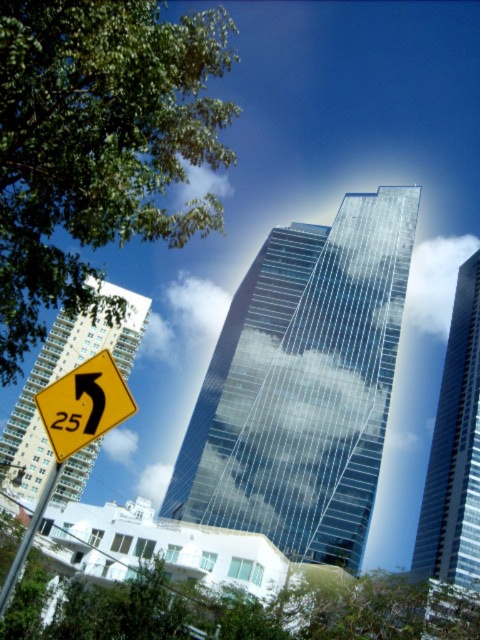
Question: Does green leafy tree at upper left appear over metallic pole at lower left?

Choices:
 (A) no
 (B) yes

Answer: (B)

Question: Does green leafy tree at upper left have a larger size compared to yellow plastic sign at lower left?

Choices:
 (A) yes
 (B) no

Answer: (A)

Question: Which of the following is the closest to the observer?

Choices:
 (A) yellow plastic sign at lower left
 (B) green leafy tree at upper left
 (C) metallic pole at lower left

Answer: (A)

Question: Does green leafy tree at upper left have a smaller size compared to metallic pole at lower left?

Choices:
 (A) yes
 (B) no

Answer: (B)

Question: Considering the real-world distances, which object is closest to the yellow plastic sign at lower left?

Choices:
 (A) green leafy tree at upper left
 (B) metallic pole at lower left

Answer: (B)

Question: Estimate the real-world distances between objects in this image. Which object is closer to the yellow plastic sign at lower left?

Choices:
 (A) metallic pole at lower left
 (B) green leafy tree at upper left

Answer: (A)